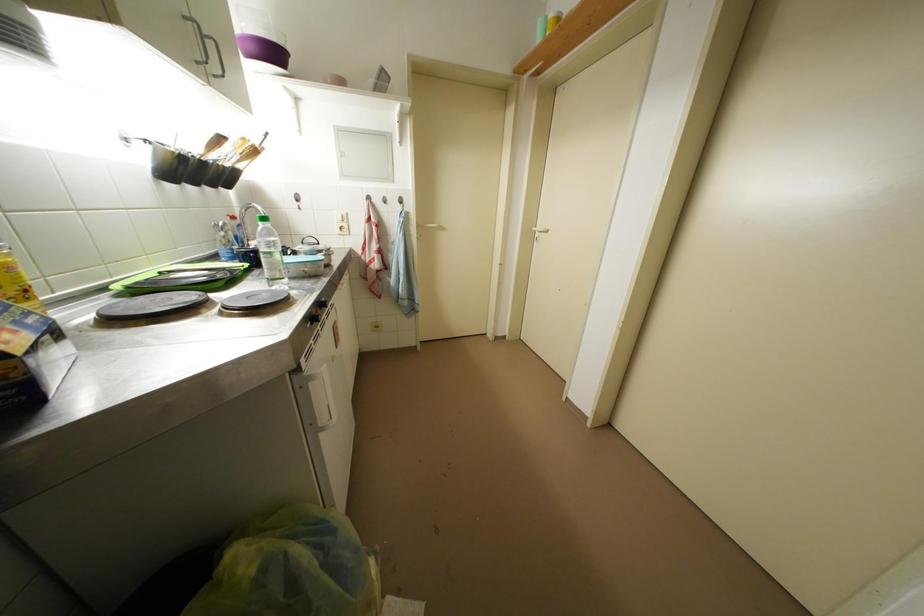
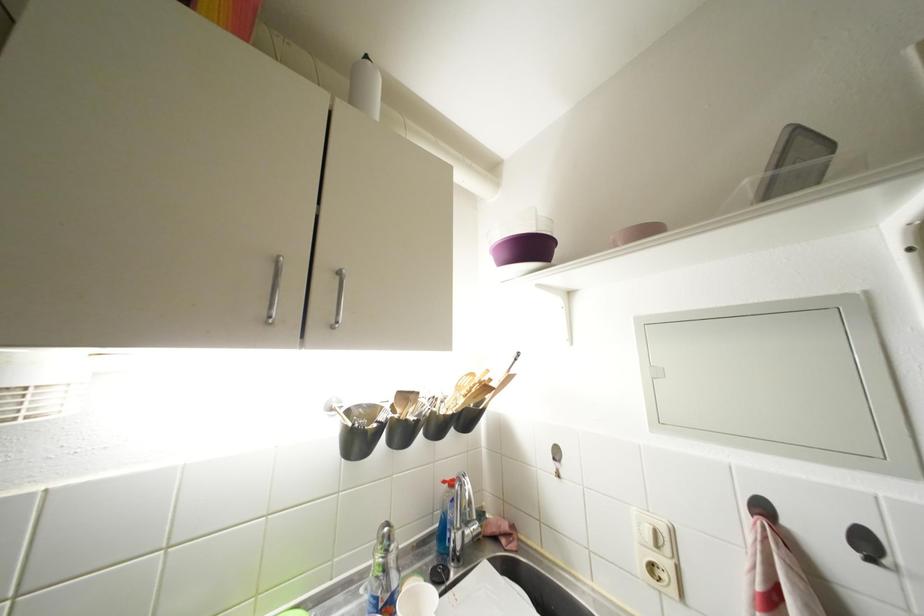
Find the pixel in the second image that matches [251,143] in the first image.

(479, 379)